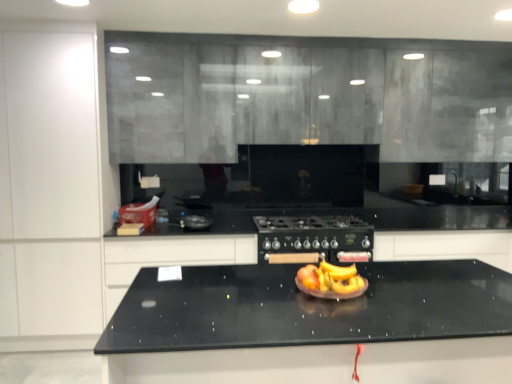
Question: Does black matte gas stove at center appear on the left side of black matte cabinet at center, the fourth cabinetry positioned from the left?

Choices:
 (A) no
 (B) yes

Answer: (B)

Question: Is black matte gas stove at center thinner than black matte cabinet at center, the first cabinetry in the right-to-left sequence?

Choices:
 (A) no
 (B) yes

Answer: (A)

Question: Would you consider black matte gas stove at center to be distant from black matte cabinet at center, the fourth cabinetry positioned from the left?

Choices:
 (A) yes
 (B) no

Answer: (B)

Question: Is black matte gas stove at center smaller than black matte cabinet at center, the fourth cabinetry positioned from the left?

Choices:
 (A) yes
 (B) no

Answer: (A)

Question: Considering the relative sizes of black matte gas stove at center and black matte cabinet at center, the fourth cabinetry positioned from the left, in the image provided, is black matte gas stove at center bigger than black matte cabinet at center, the fourth cabinetry positioned from the left,?

Choices:
 (A) no
 (B) yes

Answer: (A)

Question: From a real-world perspective, is black granite countertop at center positioned above or below shiny plastic fruit bowl at center?

Choices:
 (A) below
 (B) above

Answer: (A)

Question: Based on their positions, is black granite countertop at center located to the left or right of shiny plastic fruit bowl at center?

Choices:
 (A) left
 (B) right

Answer: (B)

Question: In terms of height, does black granite countertop at center look taller or shorter compared to shiny plastic fruit bowl at center?

Choices:
 (A) short
 (B) tall

Answer: (B)

Question: Is point (397, 271) closer or farther from the camera than point (354, 269)?

Choices:
 (A) farther
 (B) closer

Answer: (A)

Question: Is black matte cabinet at center, the fourth cabinetry positioned from the left, taller or shorter than black matte gas stove at center?

Choices:
 (A) short
 (B) tall

Answer: (B)

Question: Based on their sizes in the image, would you say black matte cabinet at center, the fourth cabinetry positioned from the left, is bigger or smaller than black matte gas stove at center?

Choices:
 (A) big
 (B) small

Answer: (A)

Question: In the image, is black matte cabinet at center, the first cabinetry in the right-to-left sequence, on the left side or the right side of black matte gas stove at center?

Choices:
 (A) right
 (B) left

Answer: (A)

Question: Is black matte cabinet at center, the first cabinetry in the right-to-left sequence, in front of or behind black matte gas stove at center in the image?

Choices:
 (A) behind
 (B) front

Answer: (A)

Question: From the image's perspective, is black matte gas stove at center above or below white matte cabinet at left, which ranks as the 1th cabinetry in left-to-right order?

Choices:
 (A) above
 (B) below

Answer: (B)

Question: In terms of height, does black matte gas stove at center look taller or shorter compared to white matte cabinet at left, the fourth cabinetry viewed from the right?

Choices:
 (A) tall
 (B) short

Answer: (B)